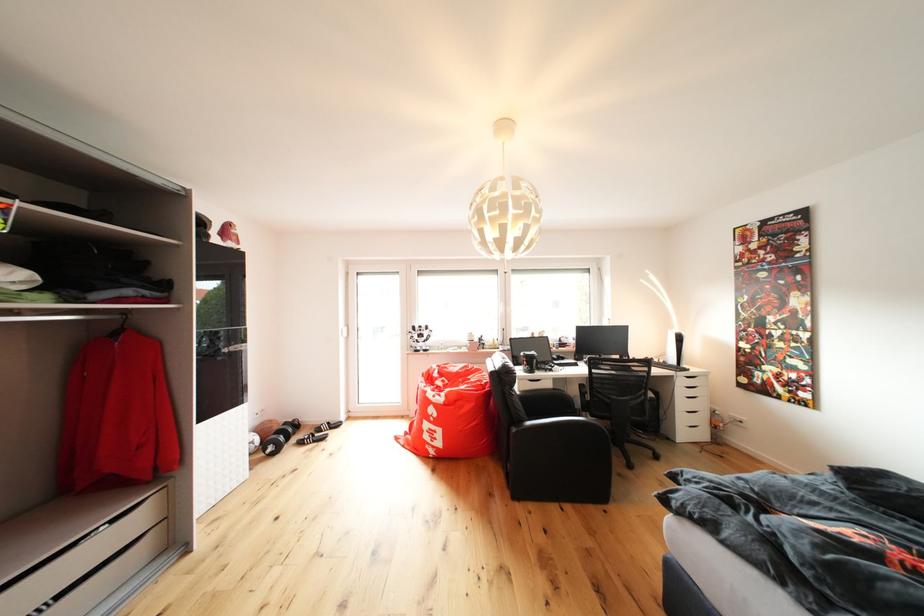
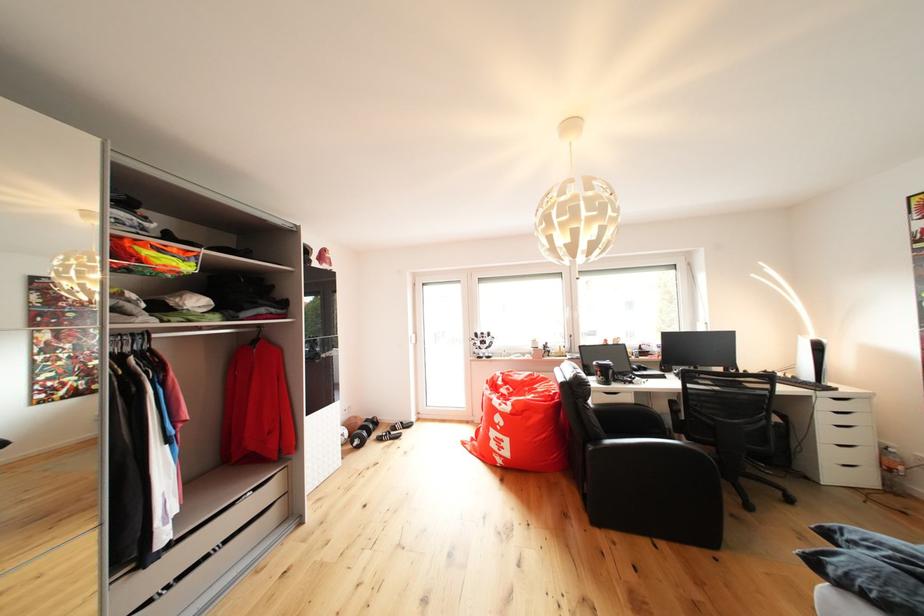
Locate, in the second image, the point that corresponds to pixel 710 411 in the first image.

(869, 444)